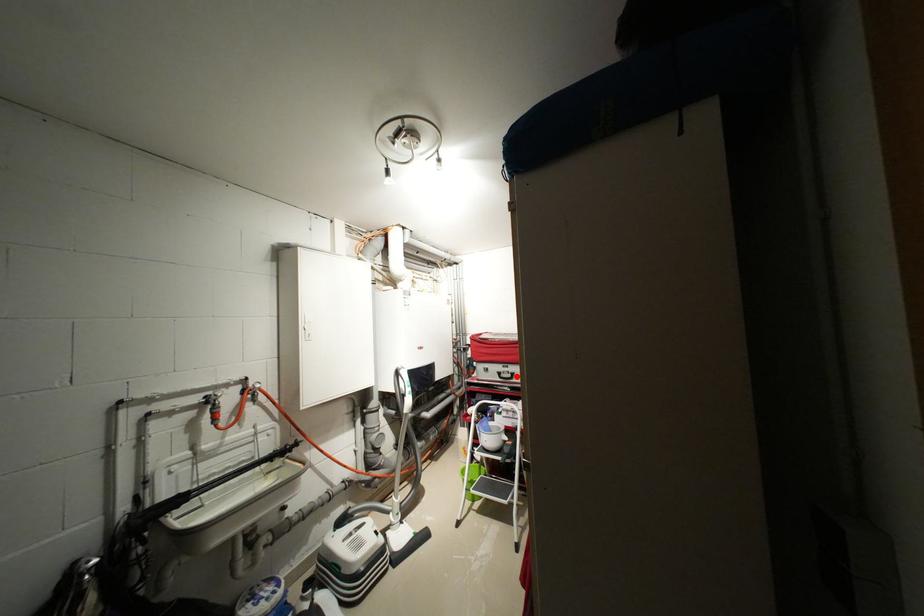
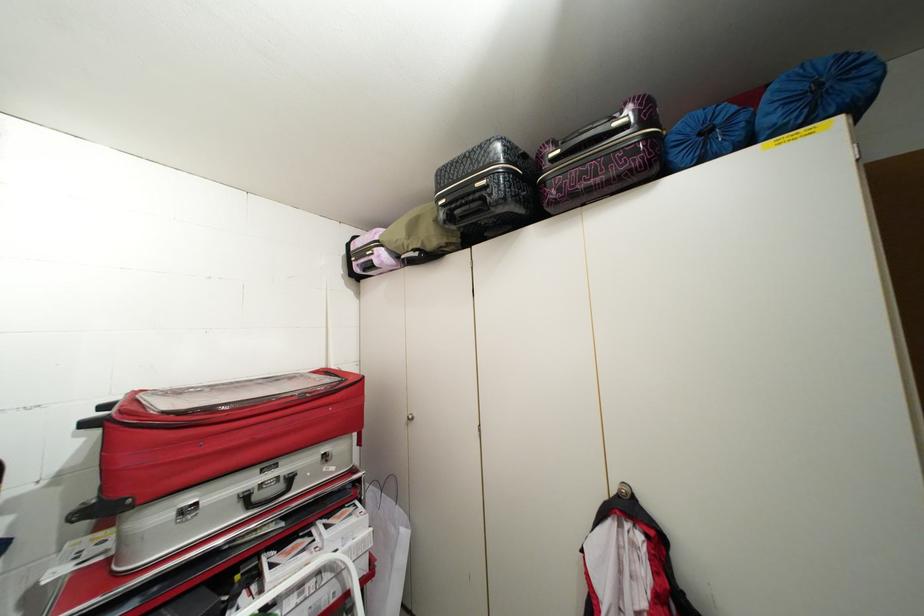
Where in the second image is the point corresponding to the highlighted location from the first image?

(287, 487)